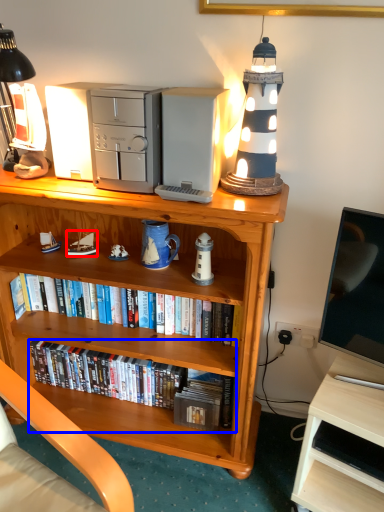
Question: Which object appears closest to the camera in this image, toy (highlighted by a red box) or book (highlighted by a blue box)?

Choices:
 (A) toy
 (B) book

Answer: (A)